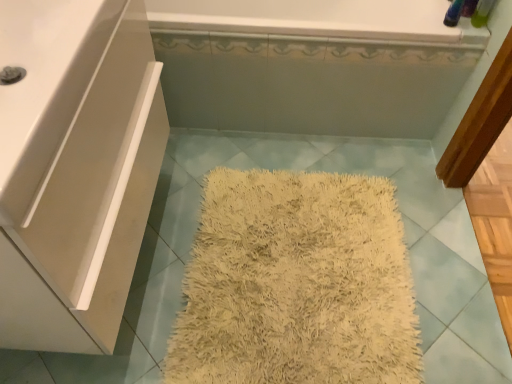
Question: From the image's perspective, is white glossy bathtub at upper center above or below white glossy sink at left?

Choices:
 (A) above
 (B) below

Answer: (A)

Question: Looking at the image, does white glossy bathtub at upper center seem bigger or smaller compared to white glossy sink at left?

Choices:
 (A) big
 (B) small

Answer: (A)

Question: Which object is positioned closest to the white glossy sink at left?

Choices:
 (A) white glossy bathtub at upper center
 (B) white glossy cabinet at left

Answer: (B)

Question: Which of these objects is positioned farthest from the white glossy bathtub at upper center?

Choices:
 (A) white glossy cabinet at left
 (B) white glossy sink at left

Answer: (B)